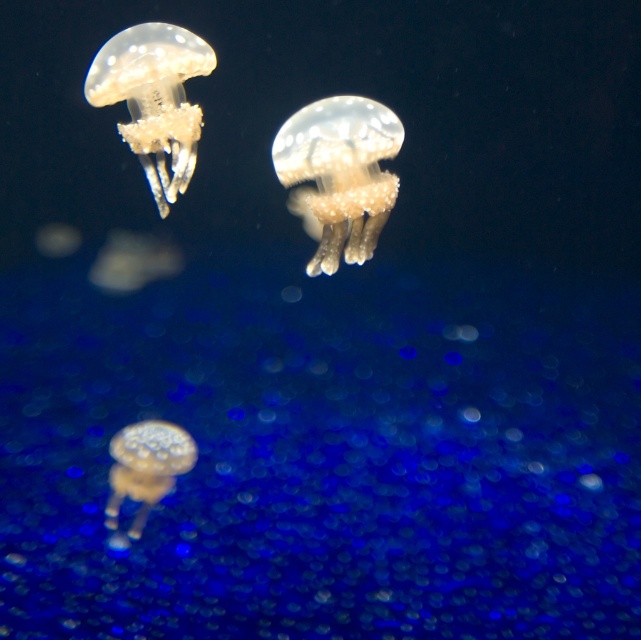
Is translucent gelatinous at upper left below translucent gelatinous at lower center?

No.

Does point (151, 54) lie behind point (167, 456)?

No.

The height and width of the screenshot is (640, 641). Find the location of `translucent gelatinous at upper left`. translucent gelatinous at upper left is located at coordinates (154, 99).

Consider the image. Can you confirm if translucent gelatinous at center is taller than translucent gelatinous at lower center?

Indeed, translucent gelatinous at center has a greater height compared to translucent gelatinous at lower center.

Locate an element on the screen. translucent gelatinous at center is located at coordinates (338, 173).

Can you confirm if translucent gelatinous at center is shorter than translucent gelatinous at upper left?

Yes, translucent gelatinous at center is shorter than translucent gelatinous at upper left.

Between point (331, 184) and point (204, 49), which one is positioned behind?

The point (204, 49) is behind.

Between point (370, 204) and point (101, 77), which one is positioned in front?

Point (370, 204)

At what (x,y) coordinates should I click in order to perform the action: click on translucent gelatinous at center. Please return your answer as a coordinate pair (x, y). The image size is (641, 640). Looking at the image, I should click on (338, 173).